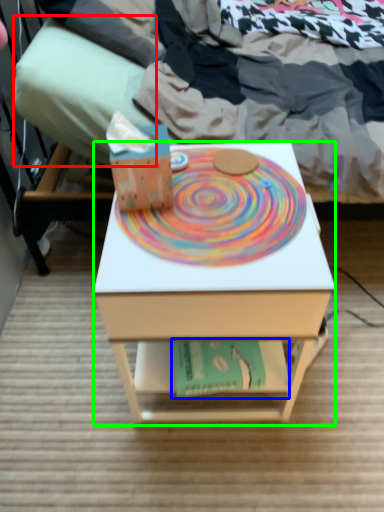
Question: Which object is the farthest from pillow (highlighted by a red box)? Choose among these: paperback book (highlighted by a blue box) or desk (highlighted by a green box).

Choices:
 (A) paperback book
 (B) desk

Answer: (A)